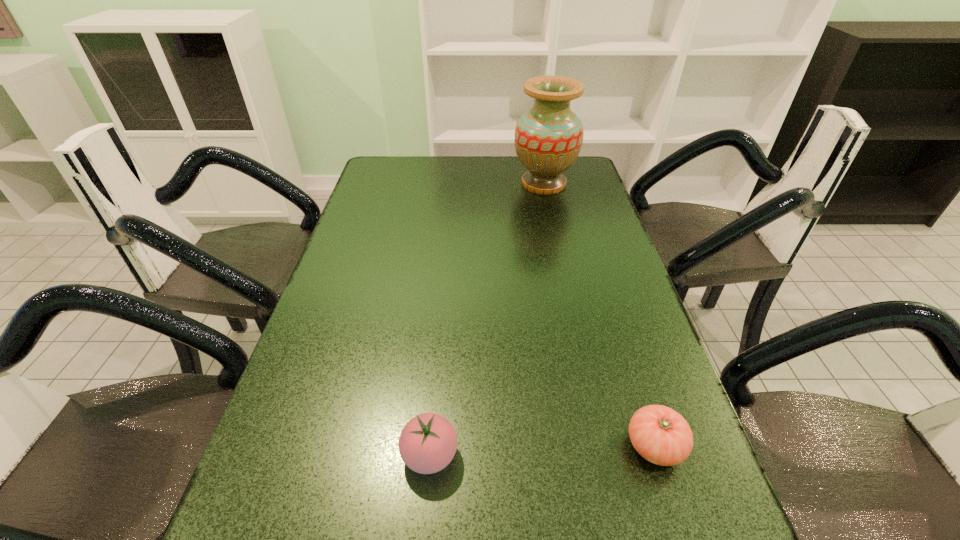
Find the location of a particular element. The image size is (960, 540). free space between the leftmost object and the right tomato is located at coordinates (542, 450).

Locate an element on the screen. empty location between the shorter tomato and the tallest object is located at coordinates (599, 315).

Identify the location of free space that is in between the shorter tomato and the farthest object. The width and height of the screenshot is (960, 540). (599, 315).

Find the location of a particular element. blank region between the left tomato and the shortest object is located at coordinates (542, 450).

Find the location of a particular element. Image resolution: width=960 pixels, height=540 pixels. vacant space in between the left tomato and the shortest object is located at coordinates (542, 450).

Identify the location of free space between the shorter tomato and the left tomato. (542, 450).

Point out which object is positioned as the second nearest to the farthest object. Please provide its 2D coordinates. Your answer should be formatted as a tuple, i.e. [(x, y)], where the tuple contains the x and y coordinates of a point satisfying the conditions above.

[(428, 442)]

Choose which object is the second nearest neighbor to the farthest object. Please provide its 2D coordinates. Your answer should be formatted as a tuple, i.e. [(x, y)], where the tuple contains the x and y coordinates of a point satisfying the conditions above.

[(428, 442)]

Image resolution: width=960 pixels, height=540 pixels. Identify the location of free region that satisfies the following two spatial constraints: 1. on the front side of the right tomato; 2. on the right side of the tallest object. (601, 446).

This screenshot has width=960, height=540. I want to click on vacant area that satisfies the following two spatial constraints: 1. on the back side of the tallest object; 2. on the left side of the leftmost object, so click(x=454, y=184).